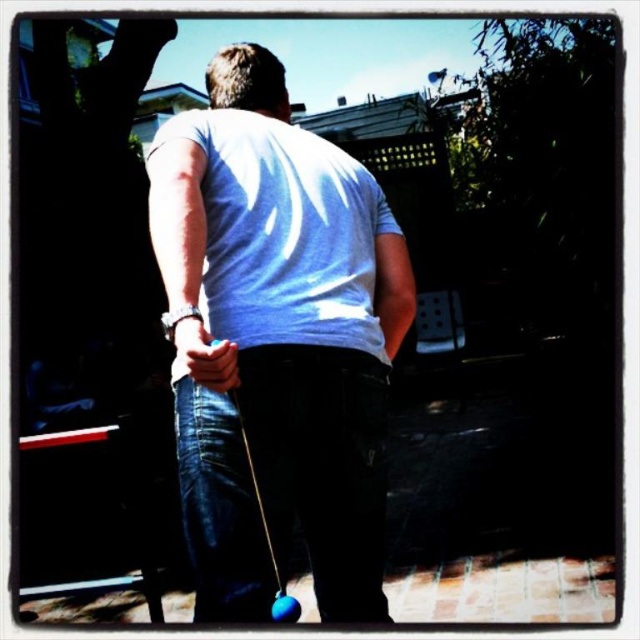
Question: Which of the following is the closest to the observer?

Choices:
 (A) [x=328, y=611]
 (B) [x=192, y=346]

Answer: (B)

Question: Can you confirm if white matte t-shirt at center is positioned above matte blue ball at center?

Choices:
 (A) yes
 (B) no

Answer: (A)

Question: Is white matte t-shirt at center bigger than matte blue ball at center?

Choices:
 (A) yes
 (B) no

Answer: (A)

Question: From the image, what is the correct spatial relationship of white matte t-shirt at center in relation to matte blue ball at center?

Choices:
 (A) below
 (B) above

Answer: (B)